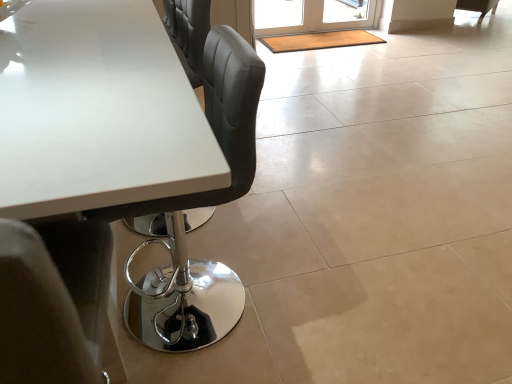
Question: From the image's perspective, is white glossy table at upper left beneath matte black chair at upper right?

Choices:
 (A) yes
 (B) no

Answer: (A)

Question: Is matte black chair at upper right inside white glossy table at upper left?

Choices:
 (A) no
 (B) yes

Answer: (A)

Question: Considering the relative sizes of white glossy table at upper left and matte black chair at upper right in the image provided, is white glossy table at upper left thinner than matte black chair at upper right?

Choices:
 (A) no
 (B) yes

Answer: (A)

Question: Is white glossy table at upper left oriented towards matte black chair at upper right?

Choices:
 (A) no
 (B) yes

Answer: (A)

Question: Is white glossy table at upper left closer to the viewer compared to matte black chair at upper right?

Choices:
 (A) yes
 (B) no

Answer: (A)

Question: From a real-world perspective, is translucent glass screen door at upper center above or below white glossy table at upper left?

Choices:
 (A) below
 (B) above

Answer: (A)

Question: Considering their positions, is translucent glass screen door at upper center located in front of or behind white glossy table at upper left?

Choices:
 (A) front
 (B) behind

Answer: (B)

Question: Would you say translucent glass screen door at upper center is to the left or to the right of white glossy table at upper left in the picture?

Choices:
 (A) right
 (B) left

Answer: (A)

Question: Considering the positions of translucent glass screen door at upper center and white glossy table at upper left in the image, is translucent glass screen door at upper center wider or thinner than white glossy table at upper left?

Choices:
 (A) thin
 (B) wide

Answer: (A)

Question: Considering the positions of point (492, 8) and point (309, 29), is point (492, 8) closer or farther from the camera than point (309, 29)?

Choices:
 (A) farther
 (B) closer

Answer: (A)

Question: In the image, is matte black chair at upper right positioned in front of or behind translucent glass screen door at upper center?

Choices:
 (A) behind
 (B) front

Answer: (A)

Question: Which is correct: matte black chair at upper right is inside translucent glass screen door at upper center, or outside of it?

Choices:
 (A) outside
 (B) inside

Answer: (A)

Question: From the image's perspective, relative to translucent glass screen door at upper center, is matte black chair at upper right above or below?

Choices:
 (A) below
 (B) above

Answer: (B)

Question: Is point (370, 26) closer or farther from the camera than point (476, 1)?

Choices:
 (A) closer
 (B) farther

Answer: (A)

Question: In the image, is translucent glass screen door at upper center on the left side or the right side of matte black chair at upper right?

Choices:
 (A) right
 (B) left

Answer: (B)